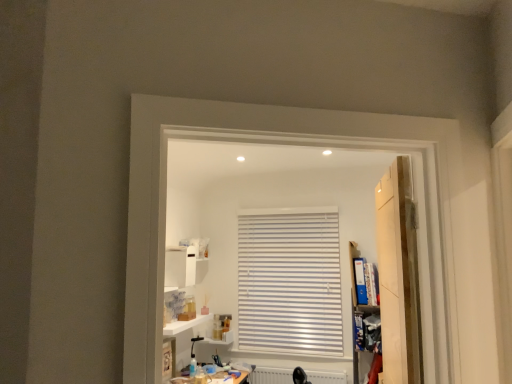
Question: Is white matte radiator at lower center inside or outside of wooden door at right?

Choices:
 (A) inside
 (B) outside

Answer: (B)

Question: Based on their sizes in the image, would you say white matte radiator at lower center is bigger or smaller than wooden door at right?

Choices:
 (A) small
 (B) big

Answer: (A)

Question: Estimate the real-world distances between objects in this image. Which object is farther from the white matte radiator at lower center?

Choices:
 (A) white glossy cabinet at upper center
 (B) wooden door at right
 (C) white glossy shelf at lower center

Answer: (B)

Question: Which of these objects is positioned closest to the white glossy cabinet at upper center?

Choices:
 (A) white glossy shelf at lower center
 (B) wooden door at right
 (C) white matte radiator at lower center

Answer: (A)